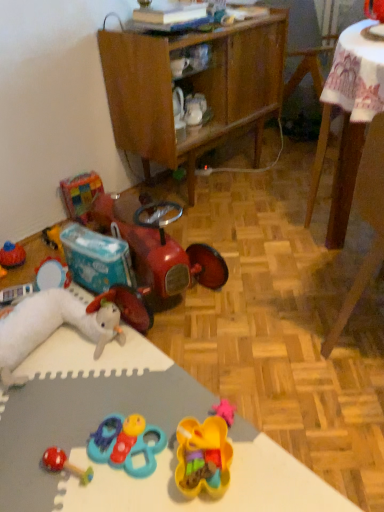
Question: From a real-world perspective, is rubberized red car at lower left, placed as the fourth toy when sorted from right to left, above or below translucent plastic container at center, the fifth toy viewed from the left?

Choices:
 (A) above
 (B) below

Answer: (A)

Question: In terms of size, does rubberized red car at lower left, positioned as the 3th toy in left-to-right order, appear bigger or smaller than translucent plastic container at center, marked as the second toy in a right-to-left arrangement?

Choices:
 (A) small
 (B) big

Answer: (B)

Question: Estimate the real-world distances between objects in this image. Which object is closer to the translucent plastic container at center, the fifth toy viewed from the left?

Choices:
 (A) wooden chair at lower right
 (B) teal plastic toy at center, which appears as the fourth toy when viewed from the left
 (C) plastic toy at center
 (D) wooden cabinet at upper center
 (E) white plush rabbit at lower left, arranged as the sixth toy when viewed from the right

Answer: (B)

Question: Which of these objects is positioned closest to the rubber duck at center, which appears as the sixth toy when viewed from the left?

Choices:
 (A) translucent plastic container at center, the fifth toy viewed from the left
 (B) rubberized red car at lower left, positioned as the 3th toy in left-to-right order
 (C) wooden chair at lower right
 (D) teal plastic toy at center, which appears as the fourth toy when viewed from the left
 (E) multicolored plastic blocks at upper left, the second toy in the left-to-right sequence

Answer: (C)